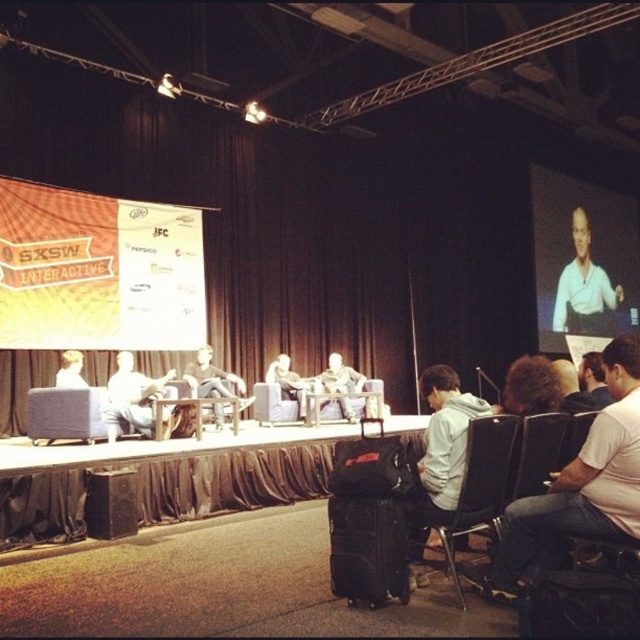
Question: Which object appears farthest from the camera in this image?

Choices:
 (A) wooden table at center
 (B) black plastic chair at lower right

Answer: (A)

Question: Which of these objects is positioned closest to the light gray fabric chair at center?

Choices:
 (A) light brown leather chair at center
 (B) light gray fabric couch at center
 (C) wooden table at center

Answer: (A)

Question: Can you confirm if black fabric speaker at lower left is smaller than light gray fabric couch at center?

Choices:
 (A) yes
 (B) no

Answer: (A)

Question: Is white shirt at upper right wider than velvet cushion at center?

Choices:
 (A) no
 (B) yes

Answer: (B)

Question: Which of the following is the closest to the observer?

Choices:
 (A) (554, 308)
 (B) (96, 396)
 (C) (173, 392)

Answer: (B)

Question: From the image, what is the correct spatial relationship of light brown leather chair at center in relation to light gray fabric chair at center?

Choices:
 (A) right
 (B) left

Answer: (B)